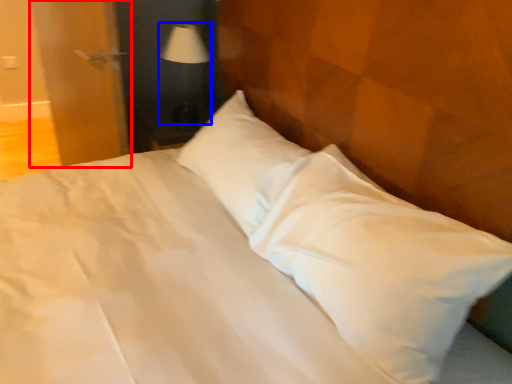
Question: Which object appears closest to the camera in this image, door (highlighted by a red box) or table lamp (highlighted by a blue box)?

Choices:
 (A) door
 (B) table lamp

Answer: (A)